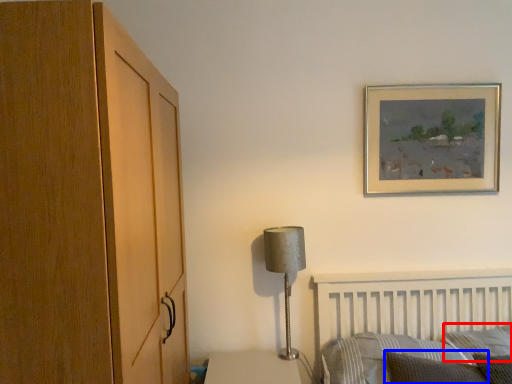
Question: Which object appears farthest to the camera in this image, pillow (highlighted by a red box) or pillow (highlighted by a blue box)?

Choices:
 (A) pillow
 (B) pillow

Answer: (A)